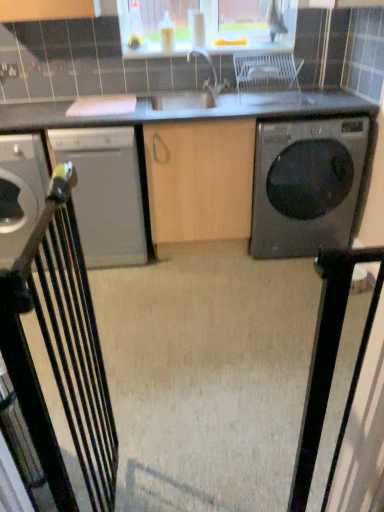
In order to click on white plastic chair at center, which appears as the 1th chair when viewed from the top in this screenshot , I will do `click(267, 71)`.

Find the location of a particular element. Image resolution: width=384 pixels, height=512 pixels. satin white dishwasher at left, placed as the 2th home appliance when sorted from left to right is located at coordinates (105, 193).

Find the location of a particular element. This screenshot has height=512, width=384. black glossy washing machine at right is located at coordinates (306, 185).

How much space does metallic gray dishwasher at left, which is the 2th home appliance from right to left, occupy vertically?

79.85 centimeters.

The height and width of the screenshot is (512, 384). Identify the location of metallic black gate at left, which is counted as the second chair, starting from the back. (61, 352).

Is satin white dishwasher at left, marked as the first home appliance in a right-to-left arrangement, aimed at black glossy washing machine at right?

No, satin white dishwasher at left, marked as the first home appliance in a right-to-left arrangement, is not turned towards black glossy washing machine at right.

Is satin white dishwasher at left, marked as the first home appliance in a right-to-left arrangement, inside the boundaries of black glossy washing machine at right, or outside?

satin white dishwasher at left, marked as the first home appliance in a right-to-left arrangement, cannot be found inside black glossy washing machine at right.

Is satin white dishwasher at left, placed as the 2th home appliance when sorted from left to right, positioned far away from black glossy washing machine at right?

No, there isn't a large distance between satin white dishwasher at left, placed as the 2th home appliance when sorted from left to right, and black glossy washing machine at right.

In terms of width, does satin white dishwasher at left, marked as the first home appliance in a right-to-left arrangement, look wider or thinner when compared to black glossy washing machine at right?

Considering their sizes, satin white dishwasher at left, marked as the first home appliance in a right-to-left arrangement, looks slimmer than black glossy washing machine at right.

Who is bigger, white plastic chair at center, the 2th chair when ordered from left to right, or metallic gray dishwasher at left, which is the 2th home appliance from right to left?

metallic gray dishwasher at left, which is the 2th home appliance from right to left, is bigger.

From a real-world perspective, which is physically below, white plastic chair at center, which appears as the 2th chair when ordered from the bottom, or metallic gray dishwasher at left, which is the 2th home appliance from right to left?

From a 3D spatial view, metallic gray dishwasher at left, which is the 2th home appliance from right to left, is below.

From the image's perspective, is white plastic chair at center, which appears as the 2th chair when ordered from the bottom, positioned above or below metallic gray dishwasher at left, which is the 2th home appliance from right to left?

white plastic chair at center, which appears as the 2th chair when ordered from the bottom, is situated higher than metallic gray dishwasher at left, which is the 2th home appliance from right to left, in the image.

From a real-world perspective, is white plastic chair at center, positioned as the second chair in front-to-back order, positioned above or below metallic black gate at left, which is counted as the 1th chair, starting from the front?

In terms of real-world spatial position, white plastic chair at center, positioned as the second chair in front-to-back order, is above metallic black gate at left, which is counted as the 1th chair, starting from the front.

Between point (257, 77) and point (69, 328), which one is positioned in front?

The point (69, 328) is more forward.

From the image's perspective, is white plastic chair at center, which appears as the 1th chair when viewed from the top, located beneath metallic black gate at left, the 2th chair positioned from the top?

Incorrect, from the image's perspective, white plastic chair at center, which appears as the 1th chair when viewed from the top, is higher than metallic black gate at left, the 2th chair positioned from the top.

Would you say metallic black gate at left, which is counted as the 1th chair, starting from the front, is part of white plastic chair at center, which appears as the 1th chair when viewed from the top,'s contents?

No, metallic black gate at left, which is counted as the 1th chair, starting from the front, is located outside of white plastic chair at center, which appears as the 1th chair when viewed from the top.

Is the position of metallic gray dishwasher at left, which is the 2th home appliance from right to left, less distant than that of white plastic chair at center, positioned as the second chair in front-to-back order?

No, the depth of metallic gray dishwasher at left, which is the 2th home appliance from right to left, is greater than that of white plastic chair at center, positioned as the second chair in front-to-back order.

From their relative heights in the image, would you say metallic gray dishwasher at left, which is the 1th home appliance from left to right, is taller or shorter than white plastic chair at center, positioned as the second chair in front-to-back order?

Considering their sizes, metallic gray dishwasher at left, which is the 1th home appliance from left to right, has more height than white plastic chair at center, positioned as the second chair in front-to-back order.

Is point (17, 236) positioned behind point (252, 81)?

No.

Is metallic gray dishwasher at left, which is the 2th home appliance from right to left, positioned with its back to white plastic chair at center, the first chair positioned from the right?

No, white plastic chair at center, the first chair positioned from the right, is not at the back of metallic gray dishwasher at left, which is the 2th home appliance from right to left.

Does satin white dishwasher at left, marked as the first home appliance in a right-to-left arrangement, touch metallic black gate at left, the 2th chair positioned from the top?

No, satin white dishwasher at left, marked as the first home appliance in a right-to-left arrangement, is not making contact with metallic black gate at left, the 2th chair positioned from the top.

Based on the photo, measure the distance from satin white dishwasher at left, marked as the first home appliance in a right-to-left arrangement, to metallic black gate at left, the 2th chair positioned from the top.

satin white dishwasher at left, marked as the first home appliance in a right-to-left arrangement, and metallic black gate at left, the 2th chair positioned from the top, are 4.42 feet apart.

Is metallic black gate at left, which is counted as the second chair, starting from the back, surrounded by satin white dishwasher at left, marked as the first home appliance in a right-to-left arrangement?

No, metallic black gate at left, which is counted as the second chair, starting from the back, is located outside of satin white dishwasher at left, marked as the first home appliance in a right-to-left arrangement.

Starting from the metallic black gate at left, arranged as the 1th chair when ordered from the bottom, which home appliance is the 1st one to the left? Please provide its 2D coordinates.

[(105, 193)]

Between metallic gray dishwasher at left, which is the 1th home appliance from left to right, and satin white dishwasher at left, placed as the 2th home appliance when sorted from left to right, which one has less height?

metallic gray dishwasher at left, which is the 1th home appliance from left to right.

Could you tell me if metallic gray dishwasher at left, which is the 1th home appliance from left to right, is facing satin white dishwasher at left, placed as the 2th home appliance when sorted from left to right?

No.

Where is `home appliance that appears below the satin white dishwasher at left, marked as the first home appliance in a right-to-left arrangement (from the image's perspective)`? The image size is (384, 512). home appliance that appears below the satin white dishwasher at left, marked as the first home appliance in a right-to-left arrangement (from the image's perspective) is located at coordinates (20, 192).

Considering the points (327, 150) and (34, 234), which point is in front, point (327, 150) or point (34, 234)?

Positioned in front is point (34, 234).

You are a GUI agent. You are given a task and a screenshot of the screen. Output one action in this format:
    pyautogui.click(x=<x>, y=<y>)
    Task: Click on the 2nd chair counting from the left side of the black glossy washing machine at right
    
    Given the screenshot: What is the action you would take?
    pyautogui.click(x=61, y=352)

Considering the relative sizes of black glossy washing machine at right and metallic black gate at left, arranged as the 1th chair when ordered from the bottom, in the image provided, is black glossy washing machine at right shorter than metallic black gate at left, arranged as the 1th chair when ordered from the bottom,?

Indeed, black glossy washing machine at right has a lesser height compared to metallic black gate at left, arranged as the 1th chair when ordered from the bottom.

Is metallic black gate at left, arranged as the 1th chair when ordered from the bottom, at the back of black glossy washing machine at right?

No.

There is a black glossy washing machine at right. Where is `the 1st home appliance above it (from a real-world perspective)`? the 1st home appliance above it (from a real-world perspective) is located at coordinates (105, 193).

What are the coordinates of `the 1st home appliance behind when counting from the white plastic chair at center, the 1th chair viewed from the back` in the screenshot? It's located at (20, 192).

Which object lies nearer to the anchor point metallic gray dishwasher at left, which is the 1th home appliance from left to right, metallic black gate at left, which is counted as the 1th chair, starting from the front, or satin white dishwasher at left, marked as the first home appliance in a right-to-left arrangement?

satin white dishwasher at left, marked as the first home appliance in a right-to-left arrangement, lies closer to metallic gray dishwasher at left, which is the 1th home appliance from left to right, than the other object.

Estimate the real-world distances between objects in this image. Which object is closer to metallic gray dishwasher at left, which is the 2th home appliance from right to left, satin white dishwasher at left, placed as the 2th home appliance when sorted from left to right, or black glossy washing machine at right?

satin white dishwasher at left, placed as the 2th home appliance when sorted from left to right.

Based on their spatial positions, is white plastic chair at center, which appears as the 2th chair when ordered from the bottom, or satin white dishwasher at left, marked as the first home appliance in a right-to-left arrangement, closer to black glossy washing machine at right?

white plastic chair at center, which appears as the 2th chair when ordered from the bottom.

Estimate the real-world distances between objects in this image. Which object is further from black glossy washing machine at right, metallic gray dishwasher at left, which is the 1th home appliance from left to right, or white plastic chair at center, the 2th chair when ordered from left to right?

metallic gray dishwasher at left, which is the 1th home appliance from left to right, lies further to black glossy washing machine at right than the other object.

From the image, which object appears to be nearer to metallic gray dishwasher at left, which is the 1th home appliance from left to right, metallic black gate at left, which is counted as the second chair, starting from the back, or white plastic chair at center, positioned as the second chair in front-to-back order?

metallic black gate at left, which is counted as the second chair, starting from the back.

Considering their positions, is black glossy washing machine at right positioned closer to white plastic chair at center, positioned as the second chair in front-to-back order, than metallic black gate at left, marked as the second chair in a right-to-left arrangement?

black glossy washing machine at right.

From the image, which object appears to be farther from white plastic chair at center, the first chair positioned from the right, metallic gray dishwasher at left, which is the 1th home appliance from left to right, or black glossy washing machine at right?

metallic gray dishwasher at left, which is the 1th home appliance from left to right, is positioned further to the anchor white plastic chair at center, the first chair positioned from the right.

Based on their spatial positions, is black glossy washing machine at right or metallic gray dishwasher at left, which is the 2th home appliance from right to left, closer to satin white dishwasher at left, placed as the 2th home appliance when sorted from left to right?

The object closer to satin white dishwasher at left, placed as the 2th home appliance when sorted from left to right, is metallic gray dishwasher at left, which is the 2th home appliance from right to left.

Locate an element on the screen. Image resolution: width=384 pixels, height=512 pixels. home appliance between metallic gray dishwasher at left, which is the 2th home appliance from right to left, and white plastic chair at center, the 1th chair viewed from the back, in the horizontal direction is located at coordinates (105, 193).

Identify the location of chair between metallic black gate at left, which is counted as the 1th chair, starting from the front, and black glossy washing machine at right from front to back. (267, 71).

What are the coordinates of `washing machine located between metallic black gate at left, arranged as the 1th chair when ordered from the bottom, and satin white dishwasher at left, marked as the first home appliance in a right-to-left arrangement, in the depth direction` in the screenshot? It's located at (306, 185).

You are a GUI agent. You are given a task and a screenshot of the screen. Output one action in this format:
    pyautogui.click(x=<x>, y=<y>)
    Task: Click on the chair between metallic black gate at left, which is counted as the 1th chair, starting from the front, and satin white dishwasher at left, placed as the 2th home appliance when sorted from left to right, from front to back
    This screenshot has height=512, width=384.
    Given the screenshot: What is the action you would take?
    pyautogui.click(x=267, y=71)